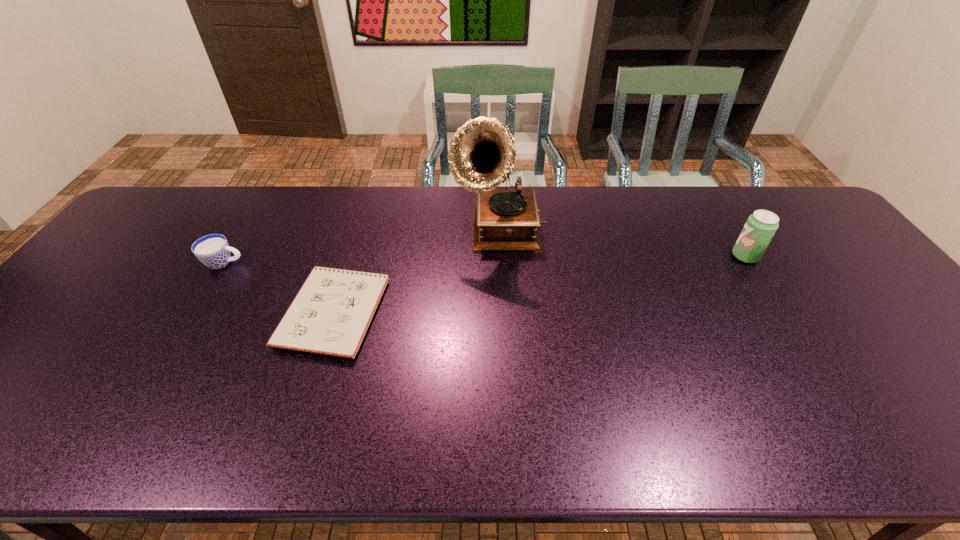
Find the location of `the tallest object`. the tallest object is located at coordinates coord(481,156).

Where is `record player`? The width and height of the screenshot is (960, 540). record player is located at coordinates (481, 156).

At what (x,y) coordinates should I click in order to perform the action: click on soda. Please return your answer as a coordinate pair (x, y). The image size is (960, 540). Looking at the image, I should click on 759,229.

Identify the location of the rightmost object. This screenshot has width=960, height=540. 759,229.

Where is `the leftmost object`? The image size is (960, 540). the leftmost object is located at coordinates (213, 250).

Where is `the third tallest object`? This screenshot has height=540, width=960. the third tallest object is located at coordinates (213, 250).

Where is `the third object from right to left`? the third object from right to left is located at coordinates tap(330, 315).

Where is `the shortest object`? the shortest object is located at coordinates (330, 315).

The image size is (960, 540). Find the location of `vacant region located 0.100m on the horn of the tallest object`. vacant region located 0.100m on the horn of the tallest object is located at coordinates (501, 286).

Where is `free location located on the front of the soda`? The image size is (960, 540). free location located on the front of the soda is located at coordinates (801, 345).